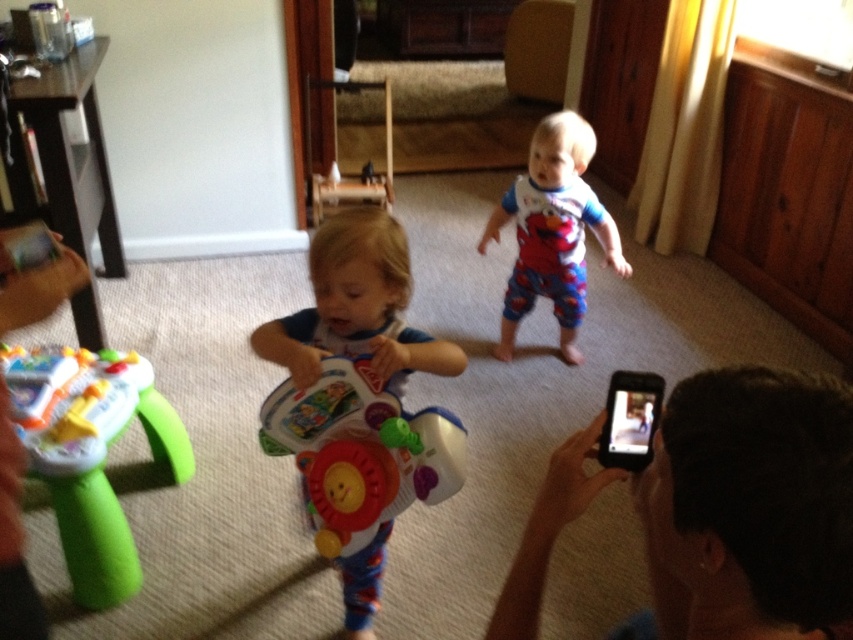
Does plastic colorful walker at center have a greater width compared to white cotton pajamas at center?

No, plastic colorful walker at center is not wider than white cotton pajamas at center.

Between plastic colorful walker at center and white cotton pajamas at center, which one appears on the left side from the viewer's perspective?

Positioned to the left is plastic colorful walker at center.

Who is more distant from viewer, (427, 424) or (520, 273)?

The point (520, 273) is more distant.

Identify the location of plastic colorful walker at center. The height and width of the screenshot is (640, 853). (360, 451).

Is point (94, 566) more distant than point (456, 424)?

Yes.

Between green plastic toy at lower left and plastic colorful walker at center, which one appears on the right side from the viewer's perspective?

plastic colorful walker at center is more to the right.

At what (x,y) coordinates should I click in order to perform the action: click on green plastic toy at lower left. Please return your answer as a coordinate pair (x, y). Looking at the image, I should click on (94, 456).

I want to click on green plastic toy at lower left, so pyautogui.click(x=94, y=456).

Between point (120, 593) and point (386, 385), which one is positioned behind?

The point (120, 593) is more distant.

Is point (96, 476) farther from viewer compared to point (351, 580)?

No.

I want to click on green plastic toy at lower left, so click(94, 456).